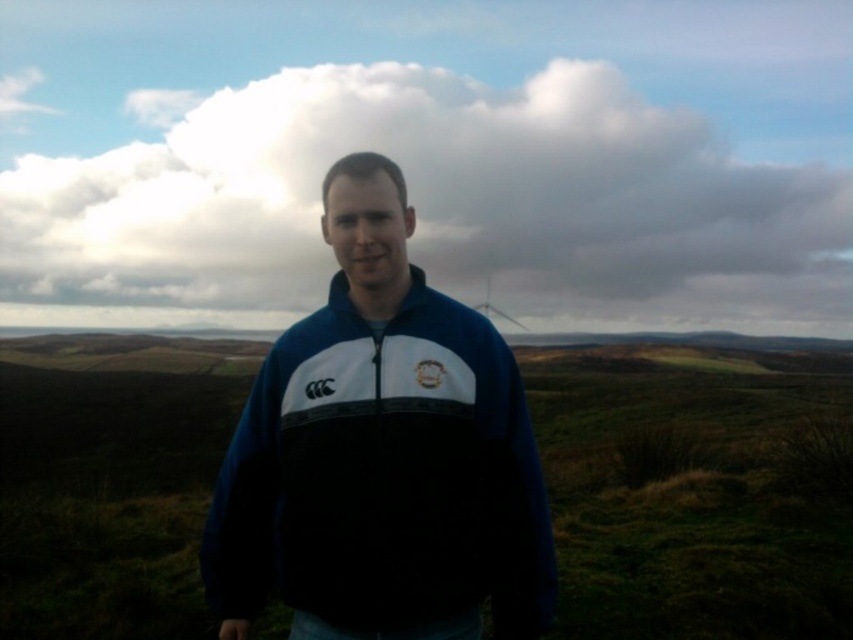
You are a photographer planning to capture a landscape shot of the white fluffy cloud at upper center and the green grassy at center. Given that the camera can focus on objects within a 40 meter range, will both objects be in focus simultaneously?

The white fluffy cloud at upper center and green grassy at center are 44.19 meters apart, which exceeds the camera focus range of 40 meters. Therefore, both objects cannot be in focus at the same time.

You are a photographer trying to capture the blue fleece jacket at center and the white plastic wind turbine at upper center in a single shot. Based on their sizes in the image, which object would you need to frame more carefully to ensure it doesn t get lost in the composition?

The blue fleece jacket at center occupies less space than the white plastic wind turbine at upper center, so you should frame the blue fleece jacket at center more carefully to ensure it doesn t get lost in the composition.